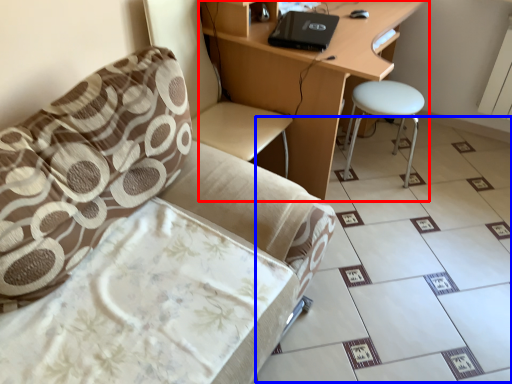
Question: Which of the following is the farthest to the observer, desk (highlighted by a red box) or ceramic tile (highlighted by a blue box)?

Choices:
 (A) desk
 (B) ceramic tile

Answer: (A)